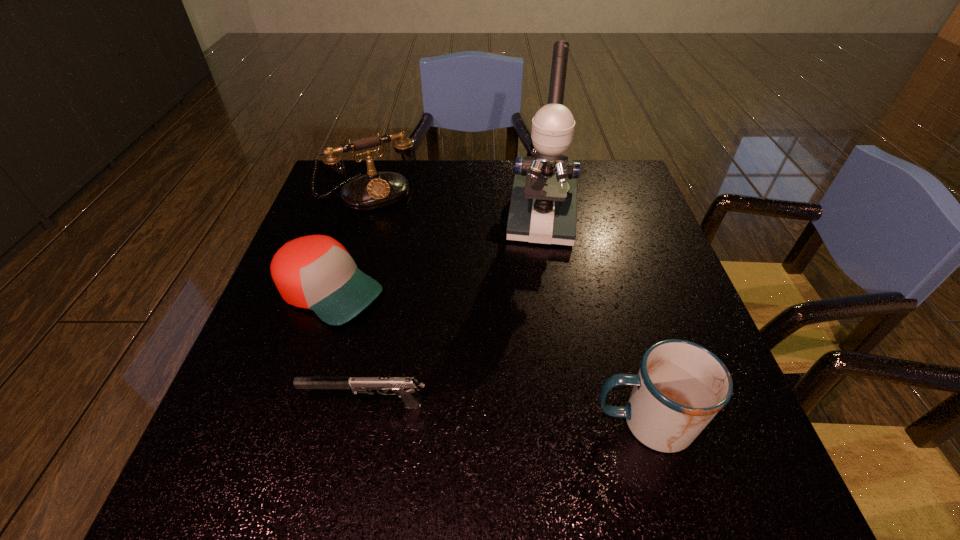
The height and width of the screenshot is (540, 960). I want to click on free region that satisfies the following two spatial constraints: 1. on the front side of the telephone; 2. at the muzzle end of the gun, so click(304, 404).

At what (x,y) coordinates should I click in order to perform the action: click on free space that satisfies the following two spatial constraints: 1. on the front side of the telephone; 2. on the handle side of the mug. Please return your answer as a coordinate pair (x, y). The width and height of the screenshot is (960, 540). Looking at the image, I should click on (299, 422).

At what (x,y) coordinates should I click in order to perform the action: click on vacant space that satisfies the following two spatial constraints: 1. on the front side of the microscope; 2. on the left side of the telephone. Please return your answer as a coordinate pair (x, y). The height and width of the screenshot is (540, 960). Looking at the image, I should click on (361, 220).